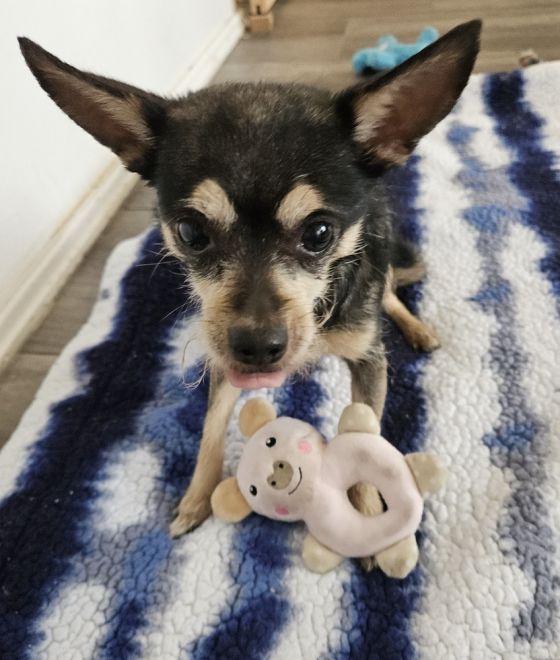
Find the location of a particular element. light brown hard wood floors is located at coordinates (317, 53).